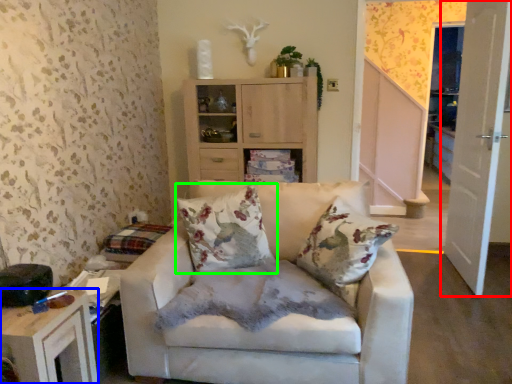
Question: Considering the real-world distances, which object is closest to door (highlighted by a red box)? table (highlighted by a blue box) or pillow (highlighted by a green box).

Choices:
 (A) table
 (B) pillow

Answer: (B)